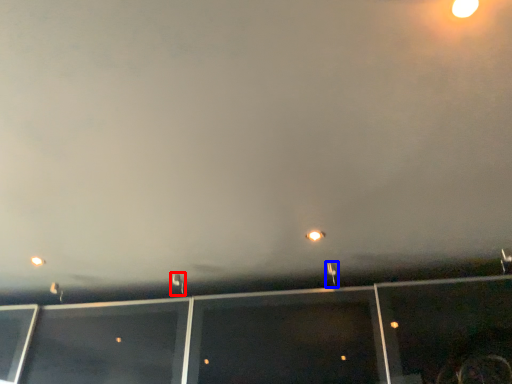
Question: Which object is closer to the camera taking this photo, street light (highlighted by a red box) or street light (highlighted by a blue box)?

Choices:
 (A) street light
 (B) street light

Answer: (B)